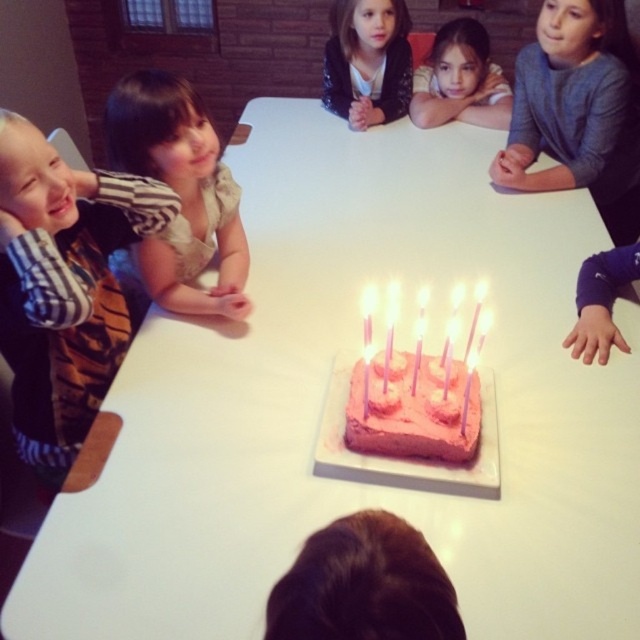
You are a photographer taking a picture of the birthday celebration. You notice the dark brown hair at lower center and the smooth beige shirt at upper center in your frame. Which object appears narrower in the photo?

The dark brown hair at lower center appears narrower because it is thinner than the smooth beige shirt at upper center.

Consider the image. You are a photographer taking a picture of the birthday cake. There are two points of interest in the scene, point 1 at coordinates point (285, 630) and point 2 at coordinates point (339, 28). Which point is closer to your camera?

Point 1 at coordinates point (285, 630) is closer to the camera than point 2 at coordinates point (339, 28).